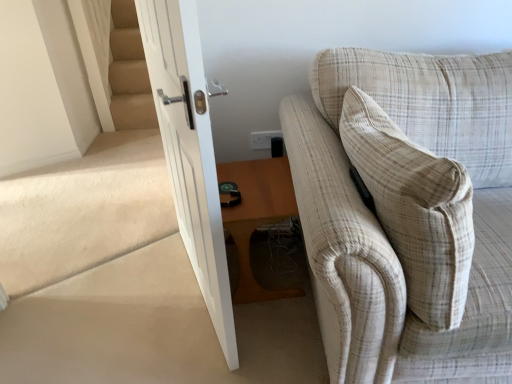
What are the coordinates of `vacant area that is in front of white glossy door at center` in the screenshot? It's located at (198, 343).